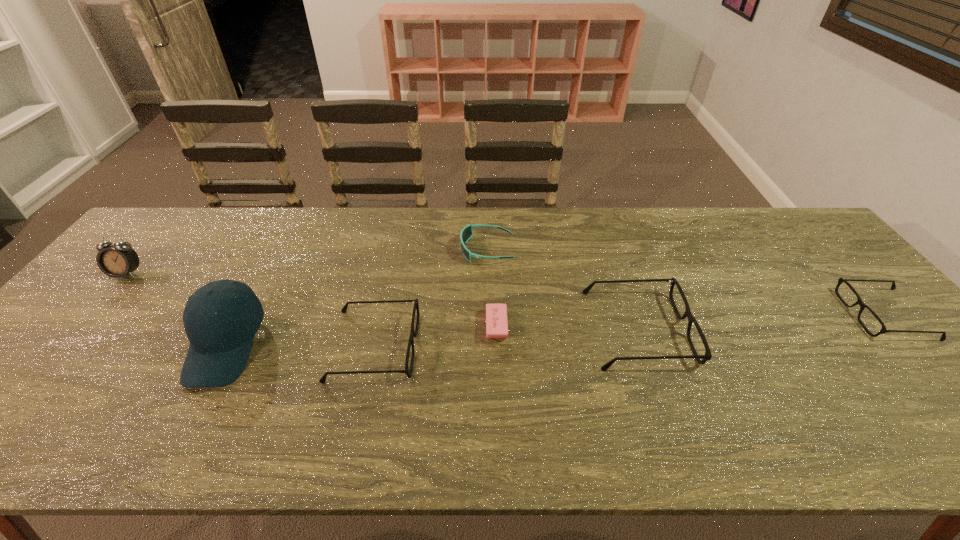
At what (x,y) coordinates should I click in order to perform the action: click on the second shortest spectacles. Please return your answer as a coordinate pair (x, y). This screenshot has height=540, width=960. Looking at the image, I should click on (413, 333).

The image size is (960, 540). Find the location of `the fifth object from right to left`. the fifth object from right to left is located at coordinates (413, 333).

Find the location of `the sixth object from left to right`. the sixth object from left to right is located at coordinates (691, 319).

I want to click on the shortest spectacles, so click(x=883, y=330).

I want to click on the rightmost spectacles, so click(883, 330).

In order to click on sunglasses in this screenshot , I will do `click(466, 233)`.

Find the location of a particular element. This screenshot has height=540, width=960. the leftmost object is located at coordinates (118, 260).

Locate an element on the screen. This screenshot has width=960, height=540. the sixth shortest object is located at coordinates (118, 260).

At what (x,y) coordinates should I click in order to perform the action: click on baseball cap. Please return your answer as a coordinate pair (x, y). Looking at the image, I should click on (220, 344).

Find the location of a particular element. This screenshot has height=540, width=960. the sixth object from right to left is located at coordinates (220, 344).